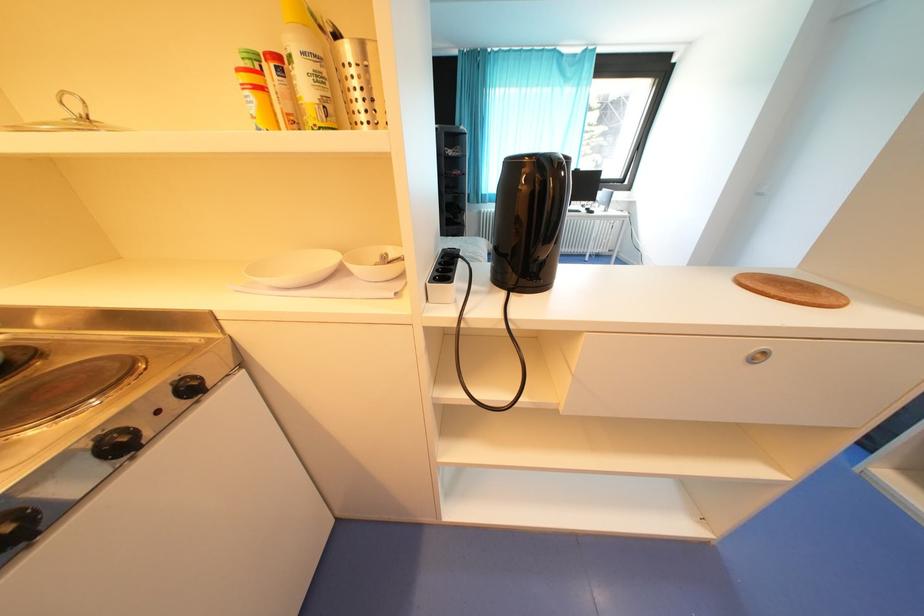
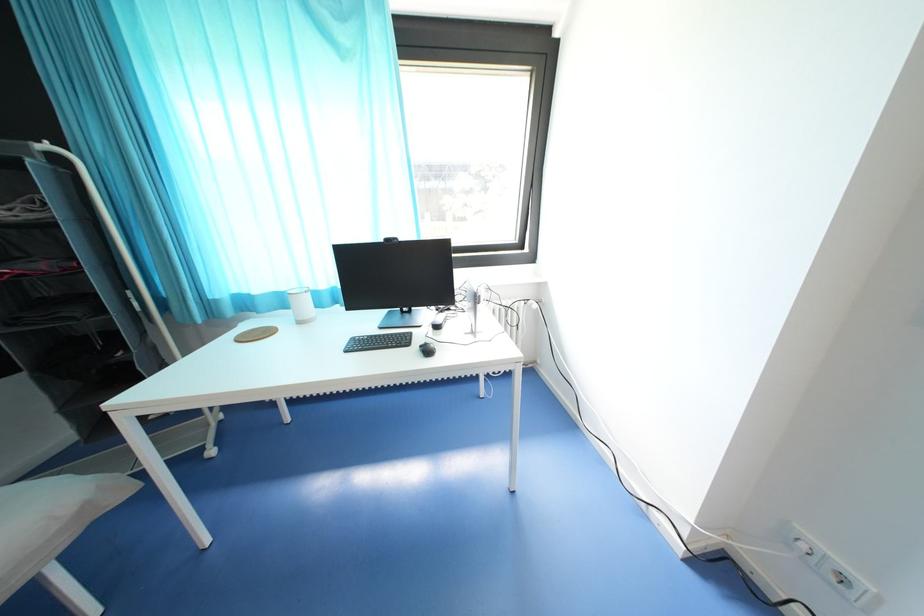
What movement of the cameraman would produce the second image?

The cameraman moved toward right, forward.